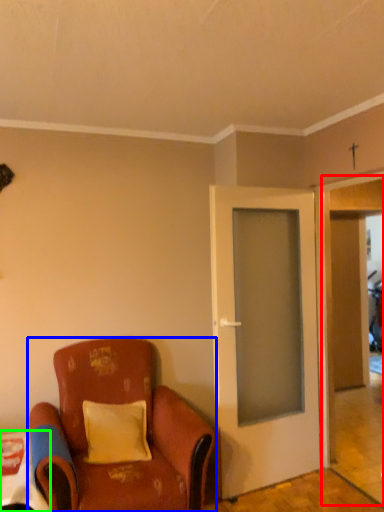
Question: Which is farther away from garage door (highlighted by a red box)? chair (highlighted by a blue box) or table (highlighted by a green box)?

Choices:
 (A) chair
 (B) table

Answer: (B)